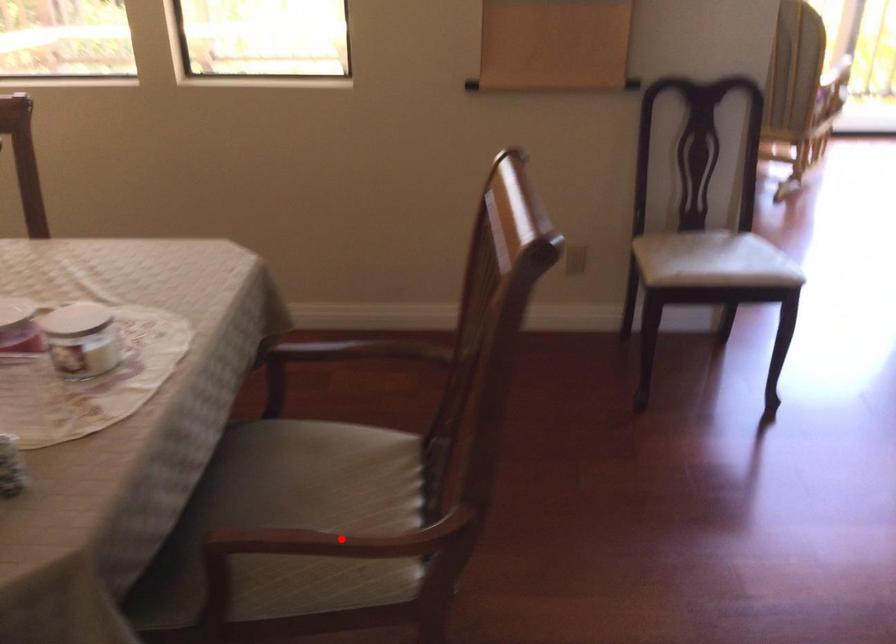
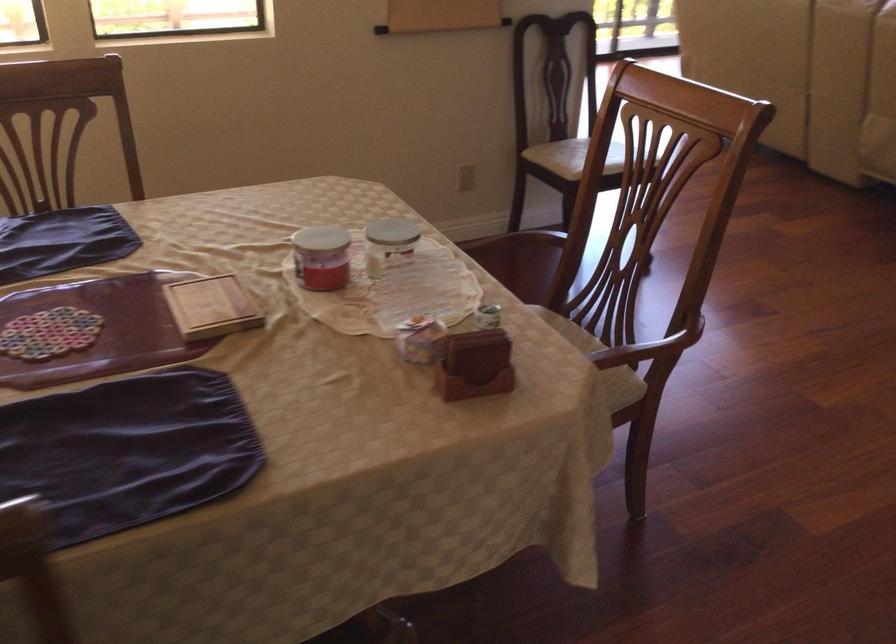
The point at the highlighted location is marked in the first image. Where is the corresponding point in the second image?

(642, 351)